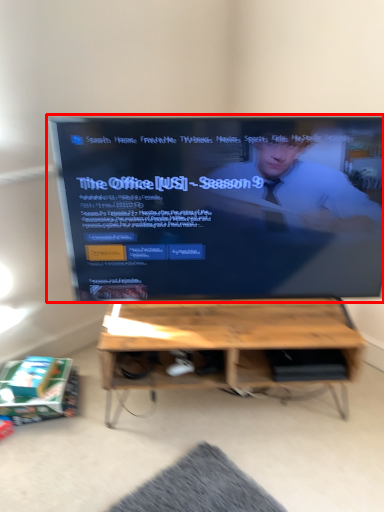
Question: Observing the image, what is the correct spatial positioning of television (annotated by the red box) in reference to table?

Choices:
 (A) right
 (B) left

Answer: (B)